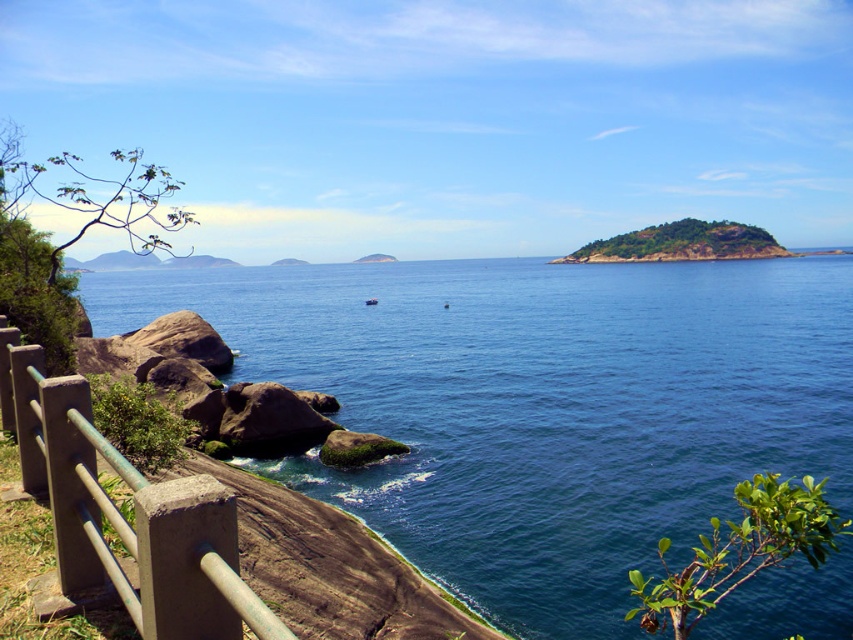
You are standing at the viewpoint overlooking the coast and see two points marked on the cliffside. The first point is at coordinates point (157, 634), and the second is at point (576, 253). Which point is nearer to your current position?

Point (157, 634) is closer to the viewer than point (576, 253), so the first point is nearer to your current position.

You are a hiker standing at the cliff edge near the concrete railing. You see the deep blue water at center and the green mossy rock at center. Which object is positioned higher from the ground level?

The green mossy rock at center is higher than the deep blue water at center because the deep blue water at center is located below the green mossy rock at center.